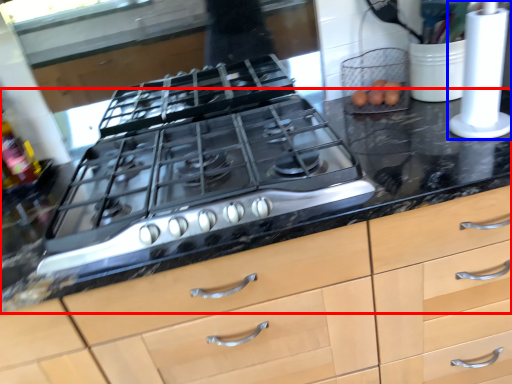
Question: Which object appears closest to the camera in this image, countertop (highlighted by a red box) or kitchen appliance (highlighted by a blue box)?

Choices:
 (A) countertop
 (B) kitchen appliance

Answer: (A)